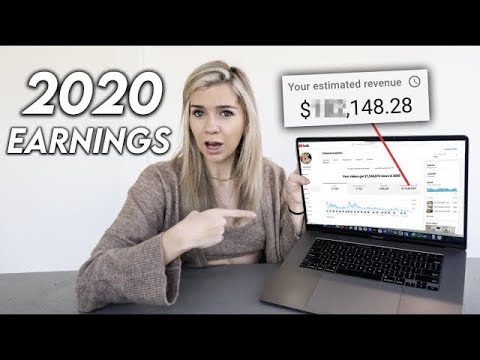
This screenshot has width=480, height=360. I want to click on trackpad, so click(x=351, y=292).